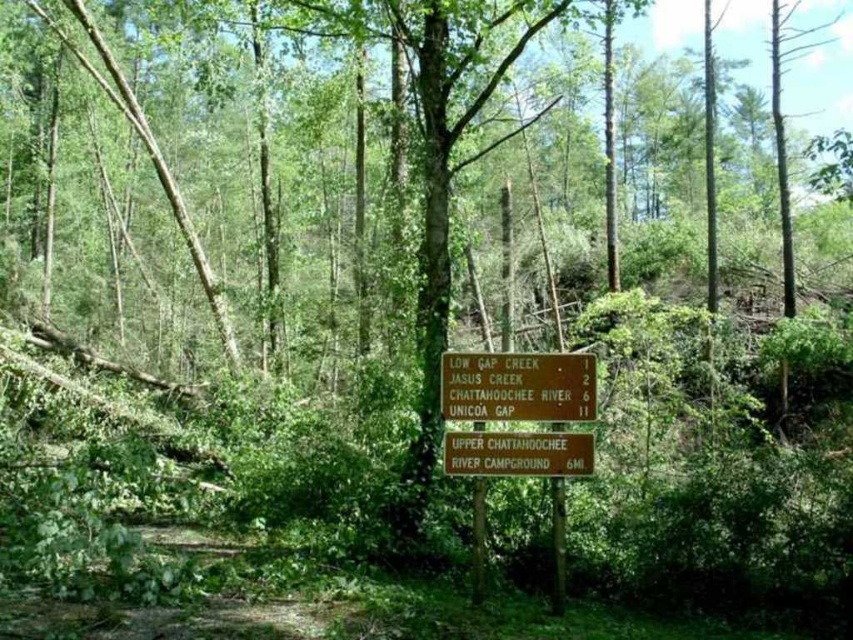
Which is behind, point (567, 417) or point (495, 458)?

The point (495, 458) is behind.

Is brown wooden sign at center positioned in front of green wooden sign at center?

Yes, brown wooden sign at center is closer to the viewer.

Between point (500, 364) and point (590, 458), which one is positioned in front?

Point (590, 458) is more forward.

Locate an element on the screen. brown wooden sign at center is located at coordinates (518, 387).